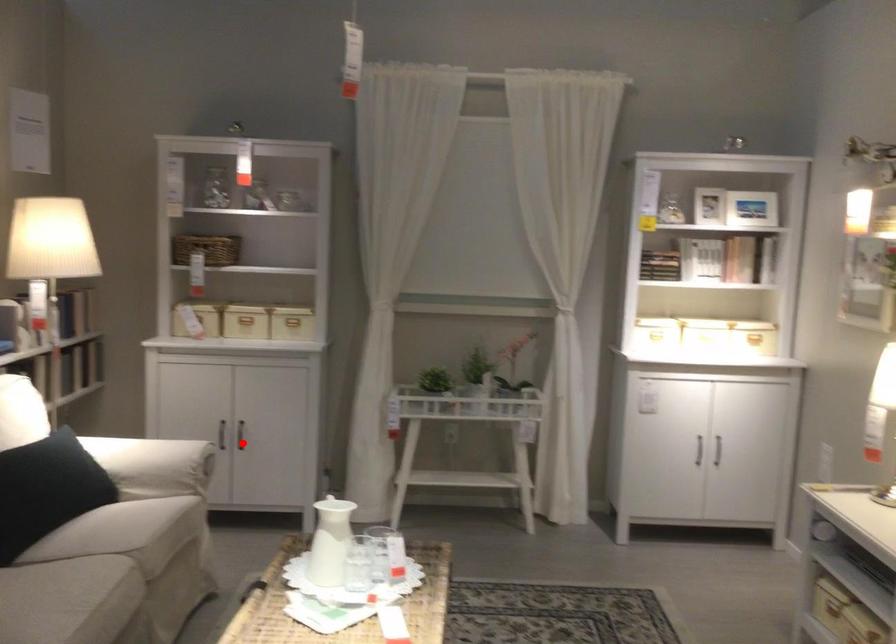
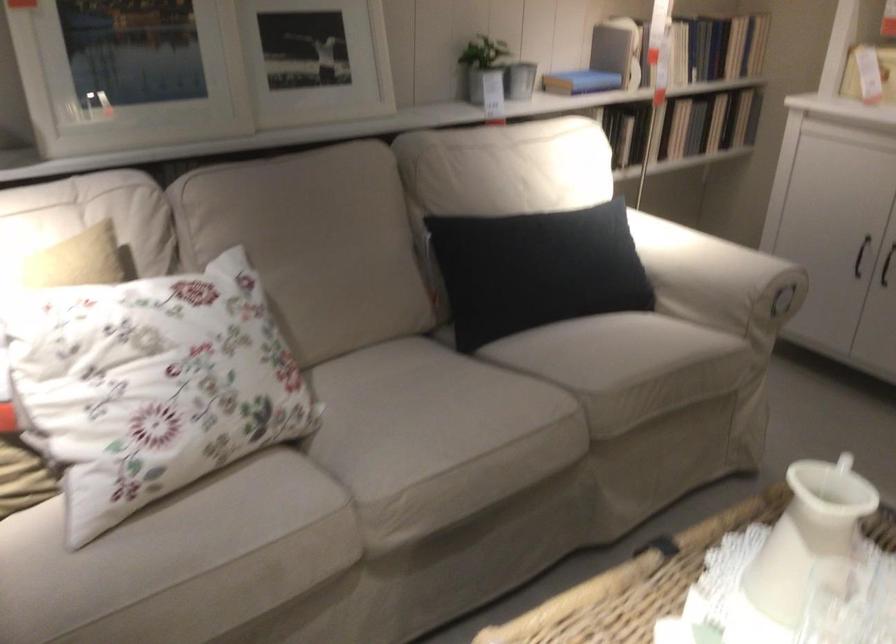
Question: I am providing you with two images of the same scene from different viewpoints. Image1 has a red point marked. In image2, the corresponding 3D location appears at what relative position? Reply with the corresponding letter.

Choices:
 (A) Closer
 (B) Farther

Answer: (A)